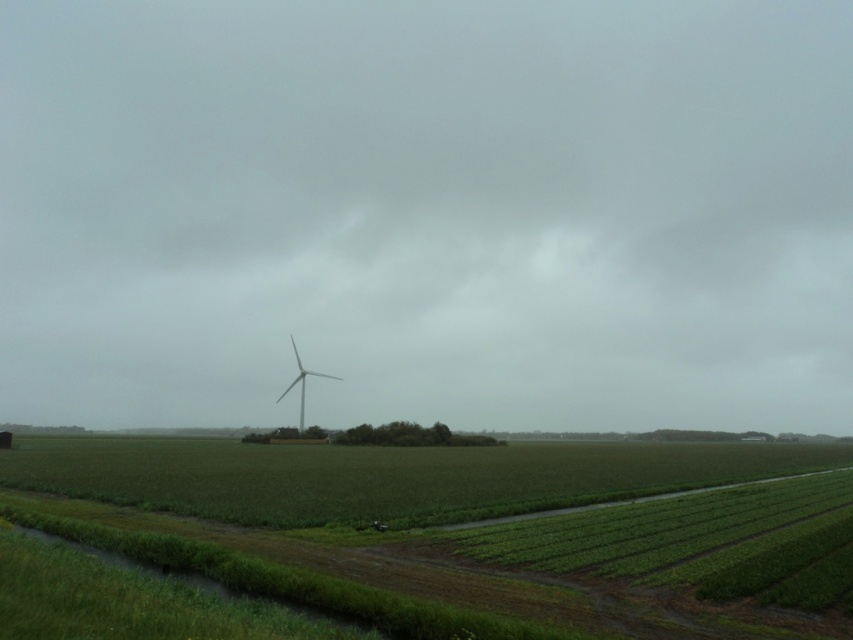
You are a farmer planning to install a new irrigation system. You have the green grassy field at center and the white matte windmill at center in your sight. Which area requires more water coverage based on their sizes?

The green grassy field at center requires more water coverage because it is larger in size than the white matte windmill at center.

Based on the photo, you are a farmer planning to install a new irrigation system between the matte white wind turbine at center and the white matte windmill at center. Based on the scene, which object is positioned higher and should be considered to avoid interference with the irrigation pipes?

The matte white wind turbine at center is located above the white matte windmill at center, so it should be considered to avoid interference with the irrigation pipes.

Based on the scene description, where exactly is the green grassy field at center located in terms of coordinates?

The green grassy field at center is located at coordinates point (428, 518).